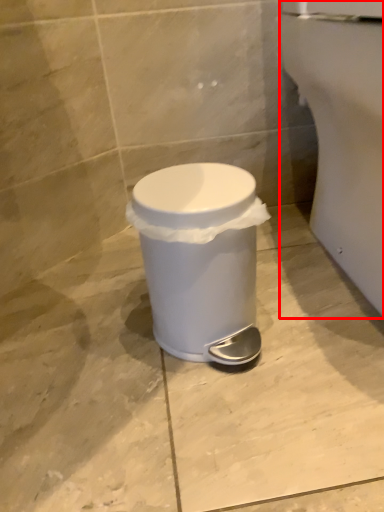
Question: From the image's perspective, what is the correct spatial relationship of porcelain (annotated by the red box) in relation to waste container?

Choices:
 (A) above
 (B) below

Answer: (A)